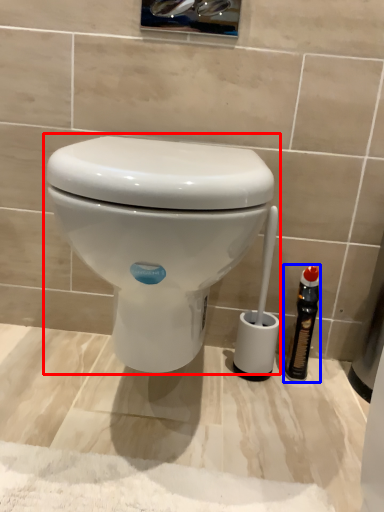
Question: Which point is closer to the camera, toilet (highlighted by a red box) or bottle (highlighted by a blue box)?

Choices:
 (A) toilet
 (B) bottle

Answer: (A)